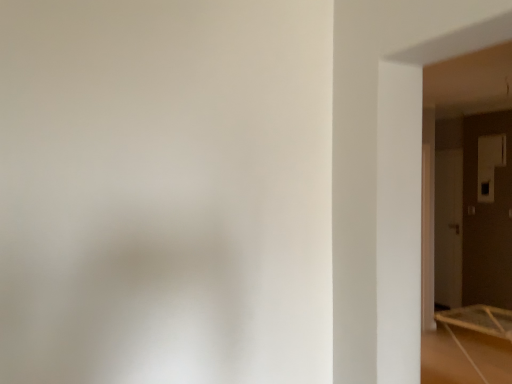
This screenshot has height=384, width=512. Identify the location of brown matte screen door at right. (448, 228).

What do you see at coordinates (448, 228) in the screenshot? I see `brown matte screen door at right` at bounding box center [448, 228].

Where is `brown matte screen door at right`? brown matte screen door at right is located at coordinates (448, 228).